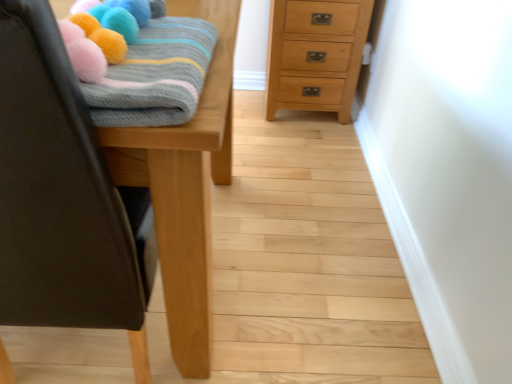
Question: Is knitted woolen blanket at upper left in front of natural wood chest of drawers at upper right?

Choices:
 (A) yes
 (B) no

Answer: (A)

Question: From the image's perspective, is knitted woolen blanket at upper left over natural wood chest of drawers at upper right?

Choices:
 (A) yes
 (B) no

Answer: (B)

Question: From a real-world perspective, is knitted woolen blanket at upper left below natural wood chest of drawers at upper right?

Choices:
 (A) yes
 (B) no

Answer: (B)

Question: Considering the relative positions of knitted woolen blanket at upper left and natural wood chest of drawers at upper right in the image provided, is knitted woolen blanket at upper left to the right of natural wood chest of drawers at upper right from the viewer's perspective?

Choices:
 (A) no
 (B) yes

Answer: (A)

Question: Does knitted woolen blanket at upper left have a greater width compared to natural wood chest of drawers at upper right?

Choices:
 (A) no
 (B) yes

Answer: (A)

Question: Is knitted woolen blanket at upper left looking in the opposite direction of natural wood chest of drawers at upper right?

Choices:
 (A) no
 (B) yes

Answer: (A)

Question: Is natural wood chest of drawers at upper right looking in the opposite direction of wooden table at left?

Choices:
 (A) yes
 (B) no

Answer: (B)

Question: Is natural wood chest of drawers at upper right shorter than wooden table at left?

Choices:
 (A) yes
 (B) no

Answer: (A)

Question: Considering the relative positions of natural wood chest of drawers at upper right and wooden table at left in the image provided, is natural wood chest of drawers at upper right in front of wooden table at left?

Choices:
 (A) yes
 (B) no

Answer: (B)

Question: Is natural wood chest of drawers at upper right further to camera compared to wooden table at left?

Choices:
 (A) yes
 (B) no

Answer: (A)

Question: Is natural wood chest of drawers at upper right at the left side of wooden table at left?

Choices:
 (A) yes
 (B) no

Answer: (B)

Question: Is natural wood chest of drawers at upper right outside wooden table at left?

Choices:
 (A) yes
 (B) no

Answer: (A)

Question: Does natural wood chest of drawers at upper right turn towards knitted woolen blanket at upper left?

Choices:
 (A) no
 (B) yes

Answer: (B)